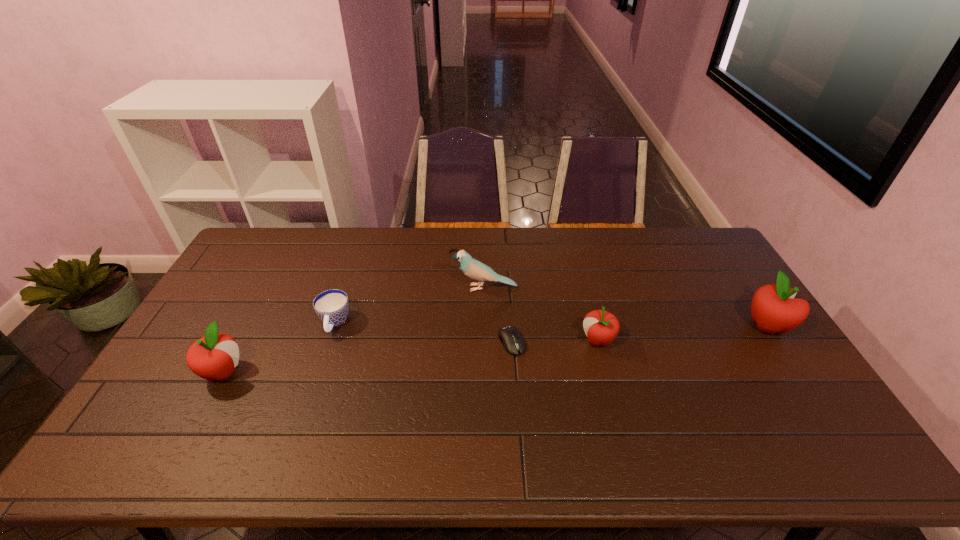
In the image, there is a desktop. At what (x,y) coordinates should I click in order to perform the action: click on free space at the near edge. Please return your answer as a coordinate pair (x, y). Looking at the image, I should click on (422, 420).

In the image, there is a desktop. At what (x,y) coordinates should I click in order to perform the action: click on free space at the left edge. Please return your answer as a coordinate pair (x, y). Looking at the image, I should click on (222, 322).

Identify the location of free space at the right edge of the desktop. This screenshot has height=540, width=960. (722, 295).

This screenshot has height=540, width=960. What are the coordinates of `vacant area at the near right corner` in the screenshot? It's located at (791, 399).

The height and width of the screenshot is (540, 960). I want to click on blank region between the rightmost apple and the computer equipment, so click(639, 334).

The width and height of the screenshot is (960, 540). I want to click on vacant area that lies between the fourth tallest object and the leftmost apple, so click(x=411, y=356).

Image resolution: width=960 pixels, height=540 pixels. Find the location of `vacant space that is in between the second apple from right to left and the rightmost apple`. vacant space that is in between the second apple from right to left and the rightmost apple is located at coordinates (683, 333).

At what (x,y) coordinates should I click in order to perform the action: click on free space between the farthest object and the second apple from left to right. Please return your answer as a coordinate pair (x, y). The height and width of the screenshot is (540, 960). Looking at the image, I should click on (540, 314).

Find the location of a particular element. vacant area between the computer equipment and the second apple from left to right is located at coordinates (555, 341).

Identify the location of vacant area that lies between the rightmost apple and the second shortest object. coord(551,325).